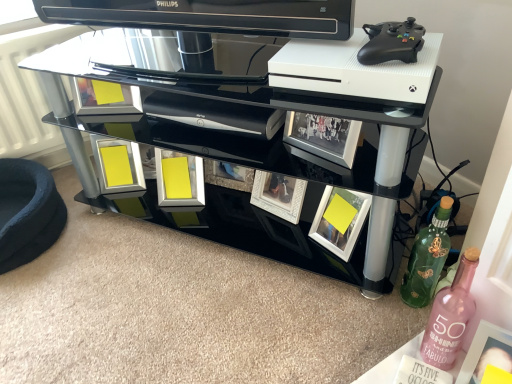
The height and width of the screenshot is (384, 512). Identify the location of free area in between metallic yellow picture frame at lower left, which ranks as the 1th picture frame in back-to-front order, and white glossy magazine at lower right. (253, 278).